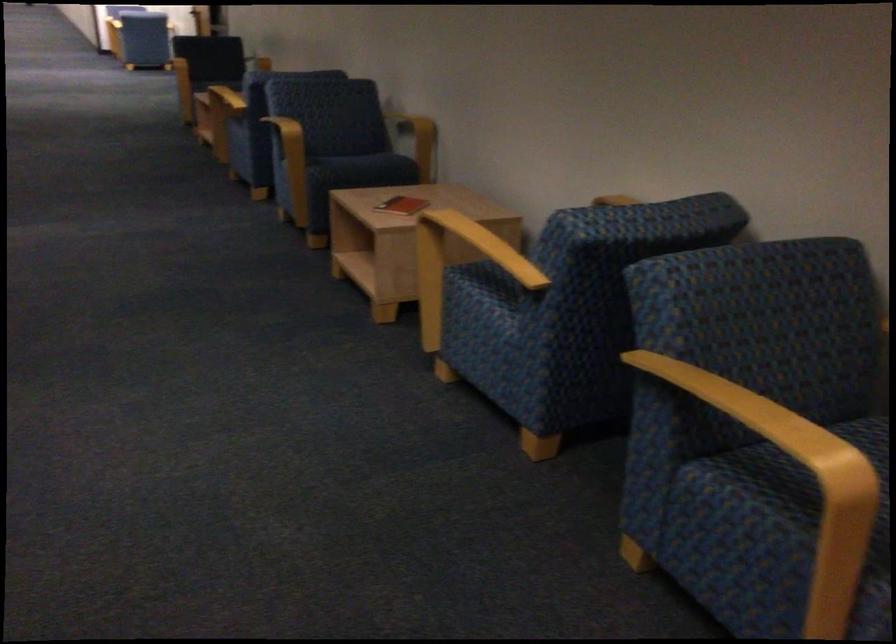
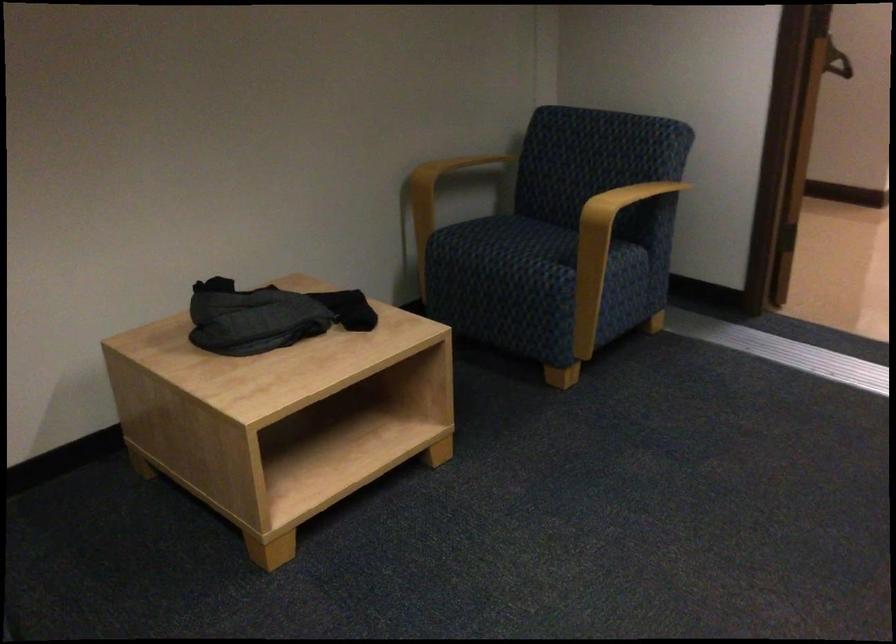
The images are taken continuously from a first-person perspective. In which direction is your viewpoint rotating?

The camera rotated toward right-down.